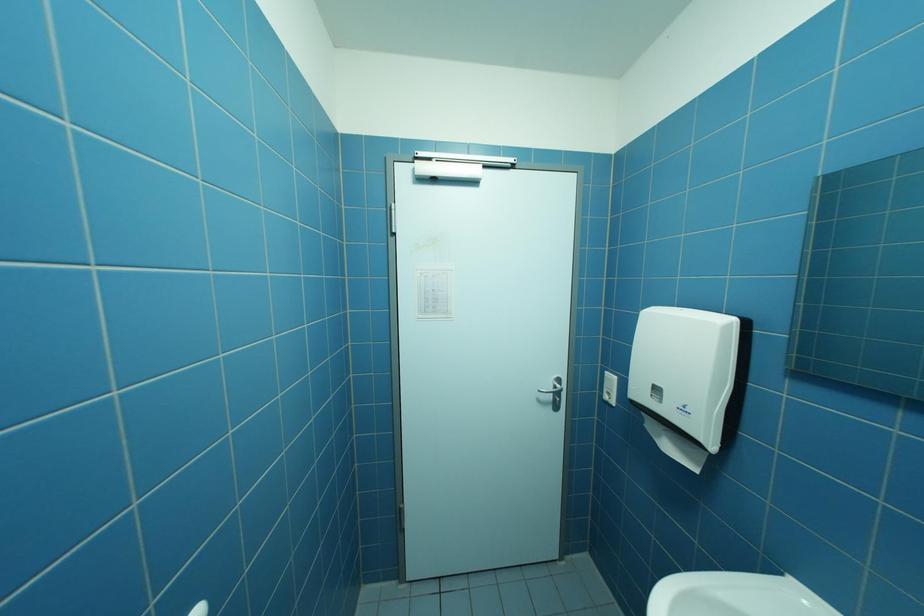
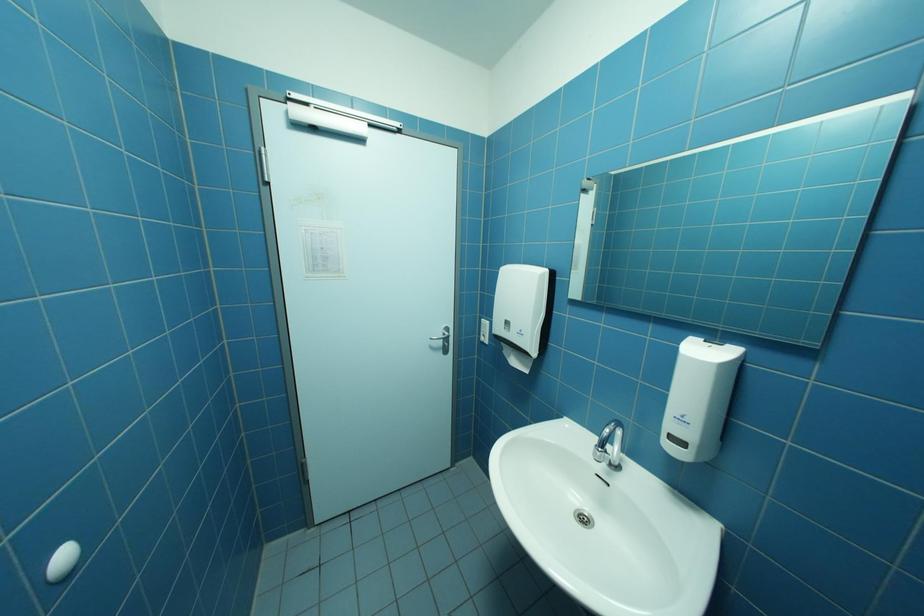
Question: How did the camera likely rotate?

Choices:
 (A) Left
 (B) Right
 (C) Up
 (D) Down

Answer: (B)